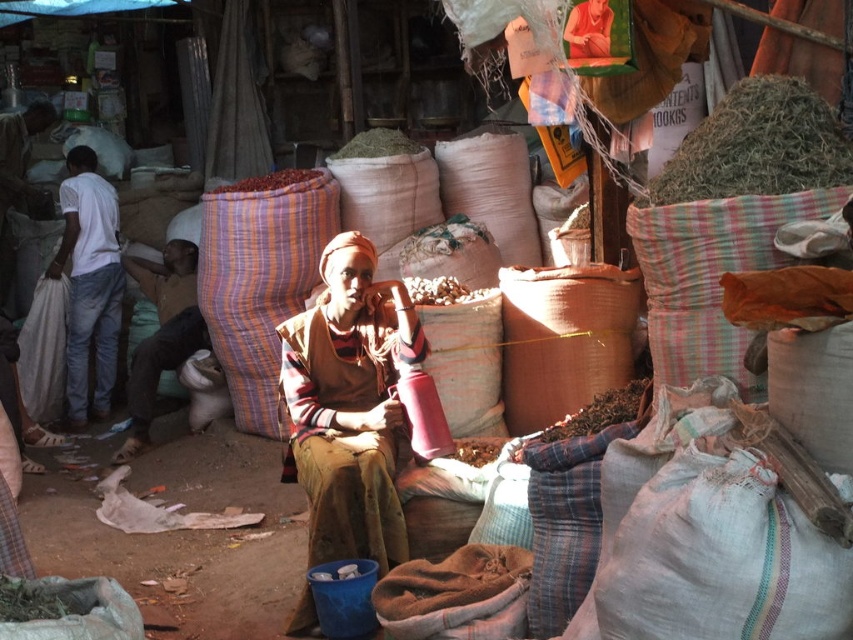
Question: Which of the following is the farthest from the observer?

Choices:
 (A) (416, 280)
 (B) (372, 131)

Answer: (B)

Question: Does brown woven fabric at left appear under brown grain at center?

Choices:
 (A) no
 (B) yes

Answer: (B)

Question: Does brown woven grain at center appear on the right side of smooth red beans at center?

Choices:
 (A) yes
 (B) no

Answer: (A)

Question: In this image, where is brown woven cloth at center located relative to smooth red beans at center?

Choices:
 (A) below
 (B) above

Answer: (A)

Question: Which point is farther from the camera taking this photo?

Choices:
 (A) (485, 445)
 (B) (97, 280)
 (C) (334, 497)
 (D) (479, 289)

Answer: (B)

Question: Which of these objects is positioned farthest from the white cotton shirt at left?

Choices:
 (A) smooth red beans at center
 (B) brown grain at center
 (C) brown woven fabric at left
 (D) brown woven cloth at center

Answer: (D)